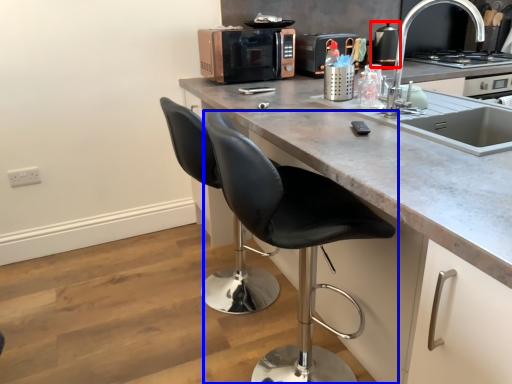
Question: Which object is closer to the camera taking this photo, appliance (highlighted by a red box) or chair (highlighted by a blue box)?

Choices:
 (A) appliance
 (B) chair

Answer: (B)